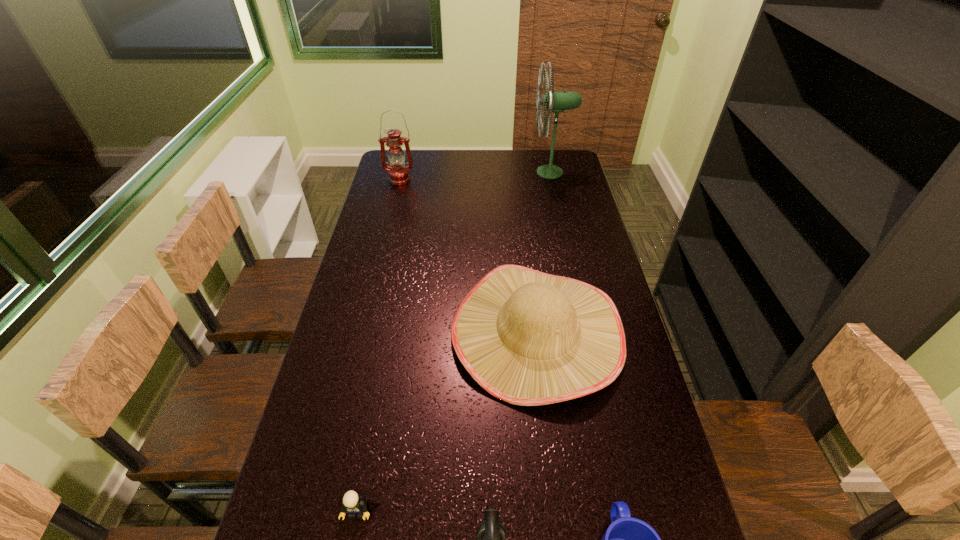
You are a GUI agent. You are given a task and a screenshot of the screen. Output one action in this format:
    pyautogui.click(x=<x>, y=<y>)
    Task: Click on the fan
    The height and width of the screenshot is (540, 960).
    Given the screenshot: What is the action you would take?
    pyautogui.click(x=556, y=102)

What are the coordinates of `oil lamp` in the screenshot? It's located at (398, 174).

You are a GUI agent. You are given a task and a screenshot of the screen. Output one action in this format:
    pyautogui.click(x=<x>, y=<y>)
    Task: Click on the third farthest object
    
    Given the screenshot: What is the action you would take?
    pyautogui.click(x=529, y=338)

Locate an element on the screen. This screenshot has width=960, height=540. the shortest object is located at coordinates (352, 504).

This screenshot has height=540, width=960. I want to click on vacant area situated on the front-facing side of the fan, so click(440, 172).

Locate an element on the screen. This screenshot has height=540, width=960. free spot located 0.300m on the front-facing side of the fan is located at coordinates coord(463,172).

Where is `vacant space located on the front-facing side of the fan`? The width and height of the screenshot is (960, 540). vacant space located on the front-facing side of the fan is located at coordinates (471, 172).

You are a GUI agent. You are given a task and a screenshot of the screen. Output one action in this format:
    pyautogui.click(x=<x>, y=<y>)
    Task: Click on the free point located 0.310m on the front of the fifth shortest object
    
    Given the screenshot: What is the action you would take?
    pyautogui.click(x=386, y=231)

I want to click on vacant space situated 0.210m on the left of the sunhat, so click(x=379, y=333).

What are the coordinates of `fan that is at the far edge` in the screenshot? It's located at (556, 102).